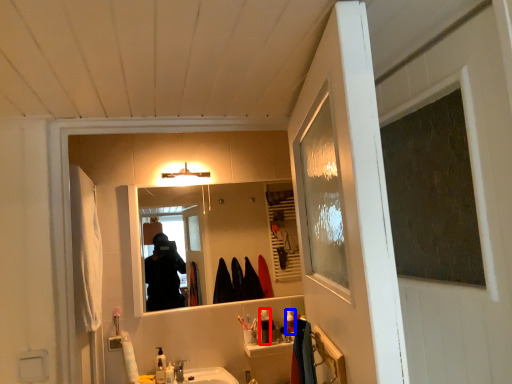
Question: Among these objects, which one is nearest to the camera, toiletry (highlighted by a red box) or toiletry (highlighted by a blue box)?

Choices:
 (A) toiletry
 (B) toiletry

Answer: (A)